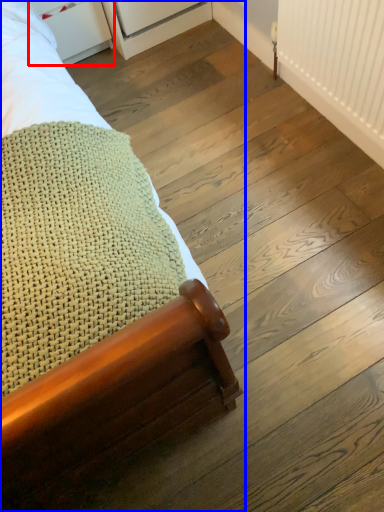
Question: Which object is closer to the camera taking this photo, drawer (highlighted by a red box) or bed (highlighted by a blue box)?

Choices:
 (A) drawer
 (B) bed

Answer: (B)